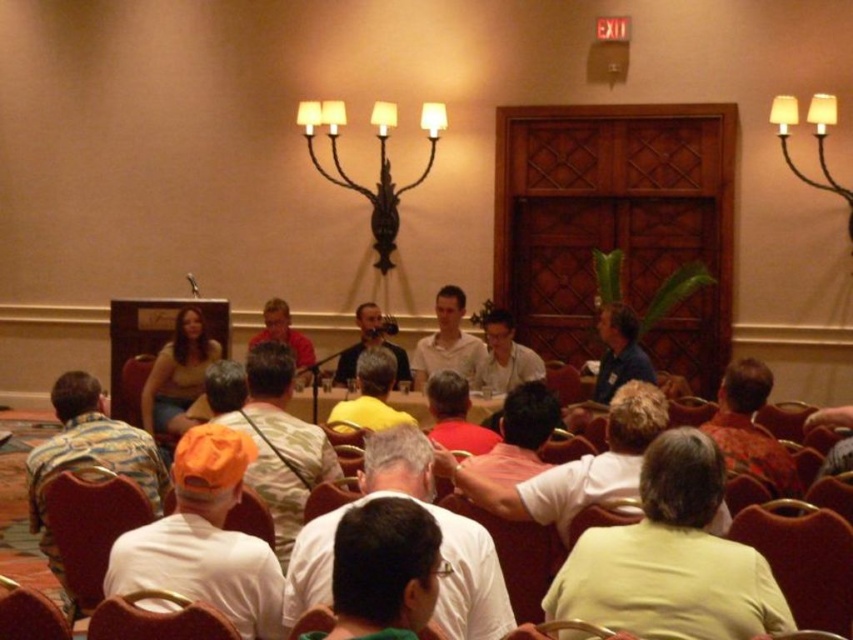
Question: Which object appears closest to the camera in this image?

Choices:
 (A) light brown shirt at center
 (B) camouflage shirt at left
 (C) camouflage shirt at center
 (D) matte white shirt at center

Answer: (A)

Question: Can you confirm if camouflage shirt at left is positioned below camouflage shirt at center?

Choices:
 (A) no
 (B) yes

Answer: (B)

Question: Is velvet red chair at lower left thinner than matte orange cap at center?

Choices:
 (A) no
 (B) yes

Answer: (A)

Question: Can you confirm if camouflage shirt at center is positioned to the left of matte white shirt at center?

Choices:
 (A) yes
 (B) no

Answer: (B)

Question: Considering the real-world distances, which object is closest to the matte white shirt at center?

Choices:
 (A) matte black shirt at center
 (B) matte red shirt at center

Answer: (A)

Question: Estimate the real-world distances between objects in this image. Which object is farther from the light green shirt at center?

Choices:
 (A) camouflage shirt at center
 (B) light gray shirt at center
 (C) matte white shirt at center

Answer: (B)